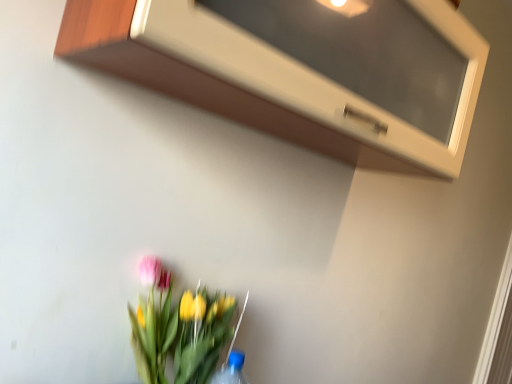
What do you see at coordinates (178, 329) in the screenshot? I see `vibrant floral bouquet at lower center` at bounding box center [178, 329].

In order to click on vibrant floral bouquet at lower center in this screenshot , I will do (178, 329).

The height and width of the screenshot is (384, 512). Describe the element at coordinates (269, 79) in the screenshot. I see `white glossy microwave at upper center` at that location.

The width and height of the screenshot is (512, 384). In order to click on white glossy microwave at upper center in this screenshot , I will do `click(269, 79)`.

Image resolution: width=512 pixels, height=384 pixels. Identify the location of vibrant floral bouquet at lower center. (178, 329).

Is vibrant floral bouquet at lower center to the right of white glossy microwave at upper center from the viewer's perspective?

No.

Looking at this image, which object is further away from the camera, vibrant floral bouquet at lower center or white glossy microwave at upper center?

vibrant floral bouquet at lower center is more distant.

Which is in front, point (162, 362) or point (298, 86)?

The point (298, 86) is closer to the camera.

From the image's perspective, is vibrant floral bouquet at lower center above or below white glossy microwave at upper center?

vibrant floral bouquet at lower center is below white glossy microwave at upper center.

From a real-world perspective, relative to white glossy microwave at upper center, is vibrant floral bouquet at lower center vertically above or below?

Clearly, from a real-world perspective, vibrant floral bouquet at lower center is below white glossy microwave at upper center.

Is vibrant floral bouquet at lower center wider than white glossy microwave at upper center?

No, vibrant floral bouquet at lower center is not wider than white glossy microwave at upper center.

Is vibrant floral bouquet at lower center taller or shorter than white glossy microwave at upper center?

vibrant floral bouquet at lower center is shorter than white glossy microwave at upper center.

Who is smaller, vibrant floral bouquet at lower center or white glossy microwave at upper center?

vibrant floral bouquet at lower center is smaller.

In the scene shown: Is vibrant floral bouquet at lower center not inside white glossy microwave at upper center?

Absolutely, vibrant floral bouquet at lower center is external to white glossy microwave at upper center.

Would you say vibrant floral bouquet at lower center is a long distance from white glossy microwave at upper center?

No, vibrant floral bouquet at lower center is in close proximity to white glossy microwave at upper center.

Is vibrant floral bouquet at lower center facing away from white glossy microwave at upper center?

vibrant floral bouquet at lower center does not have its back to white glossy microwave at upper center.

How different are the orientations of vibrant floral bouquet at lower center and white glossy microwave at upper center in degrees?

The angular difference between vibrant floral bouquet at lower center and white glossy microwave at upper center is 7.54e-05 degrees.

What are the coordinates of `floral arrangement below the white glossy microwave at upper center (from the image's perspective)` in the screenshot? It's located at coord(178,329).

Considering the positions of objects white glossy microwave at upper center and vibrant floral bouquet at lower center in the image provided, who is more to the left, white glossy microwave at upper center or vibrant floral bouquet at lower center?

Positioned to the left is vibrant floral bouquet at lower center.

Relative to vibrant floral bouquet at lower center, is white glossy microwave at upper center in front or behind?

white glossy microwave at upper center is in front of vibrant floral bouquet at lower center.

Between point (267, 71) and point (139, 299), which one is positioned in front?

Positioned in front is point (267, 71).

From the image's perspective, would you say white glossy microwave at upper center is positioned over vibrant floral bouquet at lower center?

Correct, white glossy microwave at upper center appears higher than vibrant floral bouquet at lower center in the image.

From a real-world perspective, is white glossy microwave at upper center positioned above or below vibrant floral bouquet at lower center?

Clearly, from a real-world perspective, white glossy microwave at upper center is above vibrant floral bouquet at lower center.

Between white glossy microwave at upper center and vibrant floral bouquet at lower center, which one has smaller width?

With smaller width is vibrant floral bouquet at lower center.

Based on the photo, does white glossy microwave at upper center have a lesser height compared to vibrant floral bouquet at lower center?

No, white glossy microwave at upper center is not shorter than vibrant floral bouquet at lower center.

Does white glossy microwave at upper center have a larger size compared to vibrant floral bouquet at lower center?

Correct, white glossy microwave at upper center is larger in size than vibrant floral bouquet at lower center.

Is vibrant floral bouquet at lower center a part of white glossy microwave at upper center?

No, vibrant floral bouquet at lower center is located outside of white glossy microwave at upper center.

Are white glossy microwave at upper center and vibrant floral bouquet at lower center beside each other?

No, white glossy microwave at upper center is not making contact with vibrant floral bouquet at lower center.

Does white glossy microwave at upper center turn towards vibrant floral bouquet at lower center?

No, white glossy microwave at upper center is not turned towards vibrant floral bouquet at lower center.

Can you tell me how much white glossy microwave at upper center and vibrant floral bouquet at lower center differ in facing direction?

There is a 7.54e-05-degree angle between the facing directions of white glossy microwave at upper center and vibrant floral bouquet at lower center.

At what (x,y) coordinates should I click in order to perform the action: click on microwave above the vibrant floral bouquet at lower center (from the image's perspective). Please return your answer as a coordinate pair (x, y). Looking at the image, I should click on (269, 79).

Locate an element on the screen. The width and height of the screenshot is (512, 384). floral arrangement directly beneath the white glossy microwave at upper center (from a real-world perspective) is located at coordinates [178, 329].

The image size is (512, 384). Identify the location of microwave on the right of vibrant floral bouquet at lower center. (269, 79).